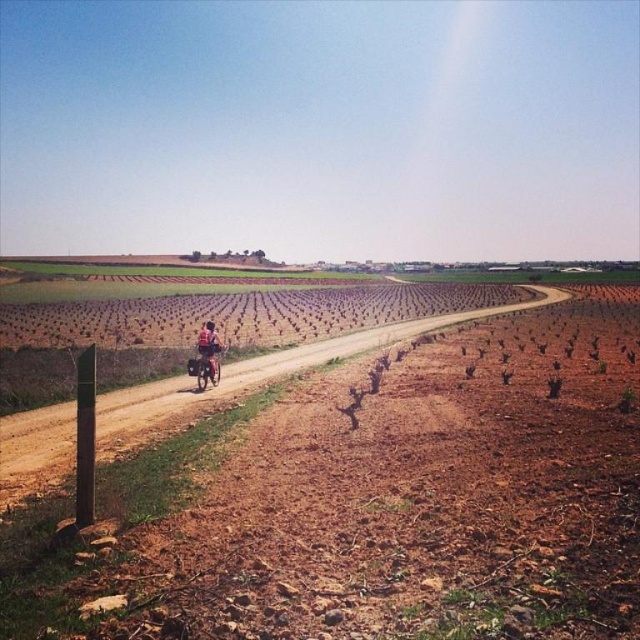
Question: Is metallic silver dirt bike at center wider than matte black bicycle at center?

Choices:
 (A) yes
 (B) no

Answer: (B)

Question: Which point is closer to the camera taking this photo?

Choices:
 (A) (220, 342)
 (B) (202, 384)

Answer: (A)

Question: Is metallic silver dirt bike at center to the left of matte black bicycle at center from the viewer's perspective?

Choices:
 (A) yes
 (B) no

Answer: (B)

Question: Considering the relative positions of metallic silver dirt bike at center and matte black bicycle at center in the image provided, where is metallic silver dirt bike at center located with respect to matte black bicycle at center?

Choices:
 (A) right
 (B) left

Answer: (A)

Question: Which point is farther from the camera taking this photo?

Choices:
 (A) (208, 369)
 (B) (202, 340)

Answer: (A)

Question: Which point is farther to the camera?

Choices:
 (A) (205, 372)
 (B) (218, 376)

Answer: (B)